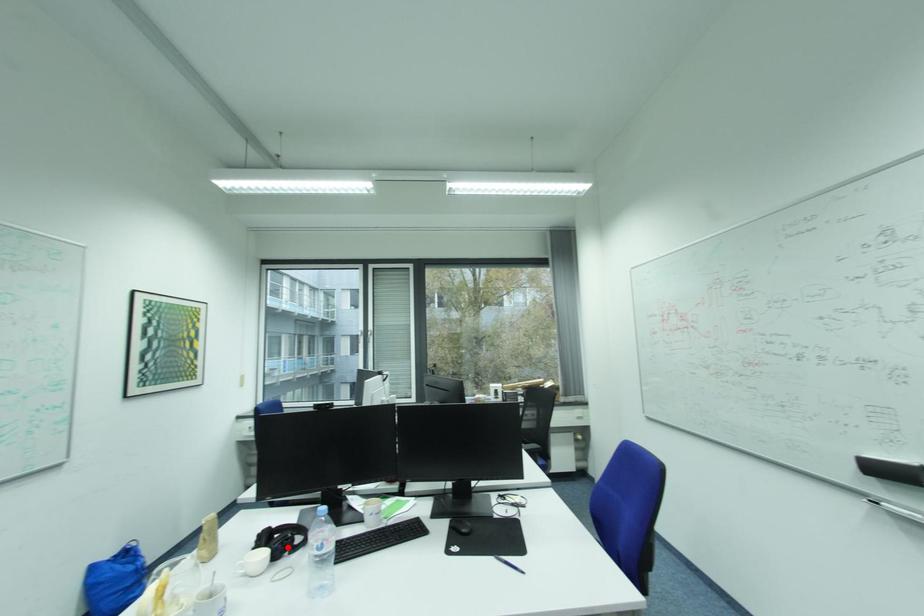
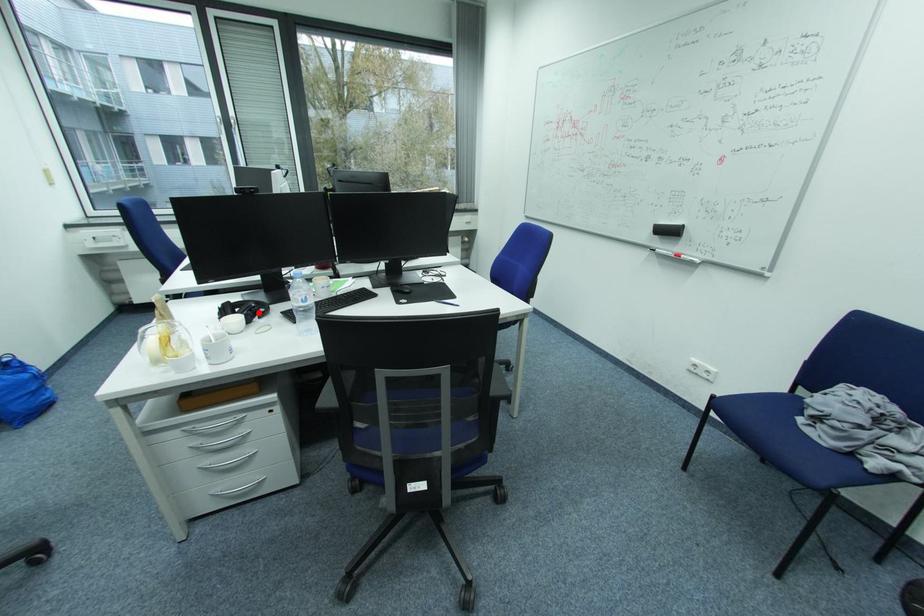
I am providing you with two images of the same scene from different viewpoints. A red point is marked on the first image and another point is marked on the second image. Are the points marked in image1 and image2 representing the same 3D position?

Yes